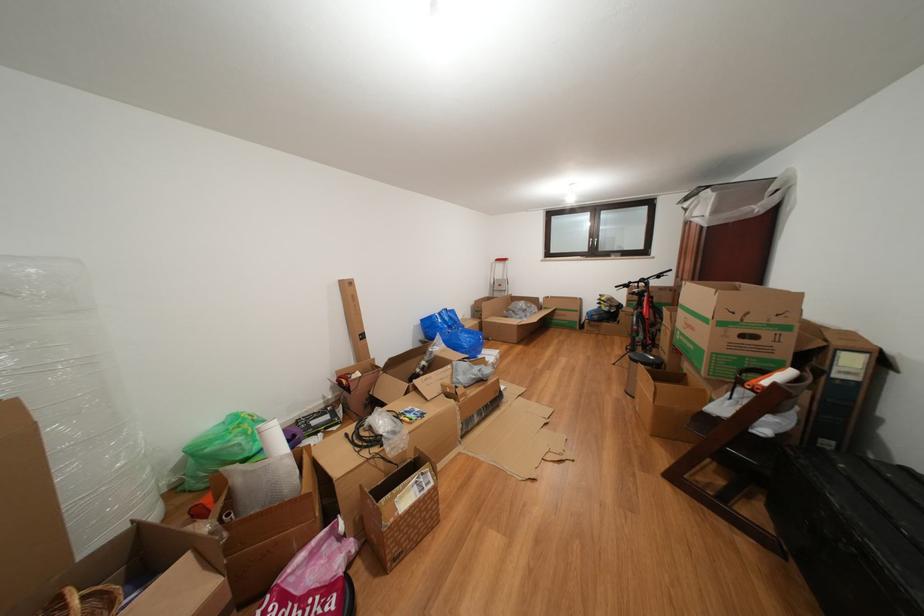
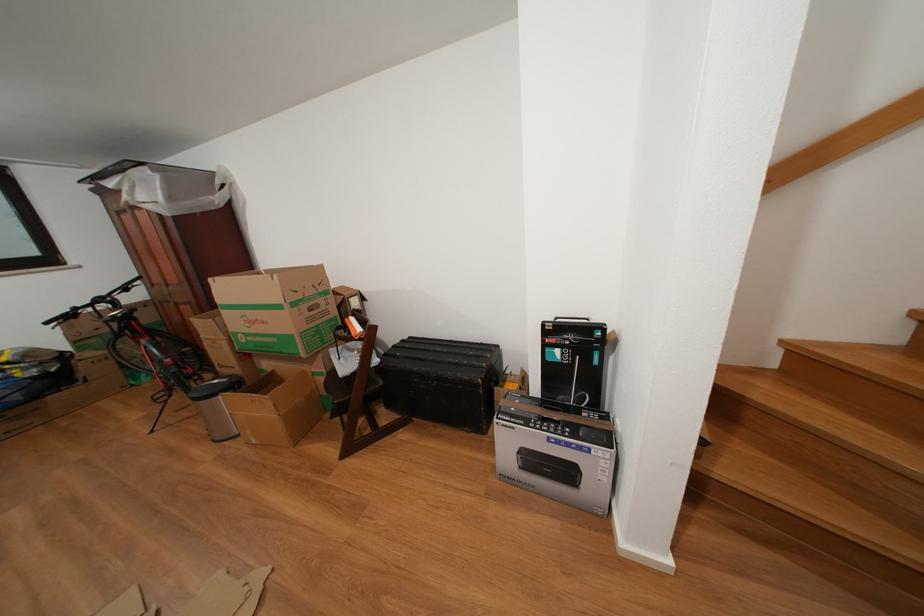
Find the pixel in the second image that matches the point at 700,334 in the first image.

(272, 328)